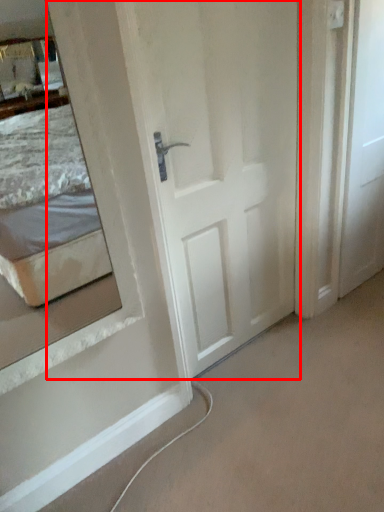
Question: Observing the image, what is the correct spatial positioning of door (annotated by the red box) in reference to door?

Choices:
 (A) right
 (B) left

Answer: (B)